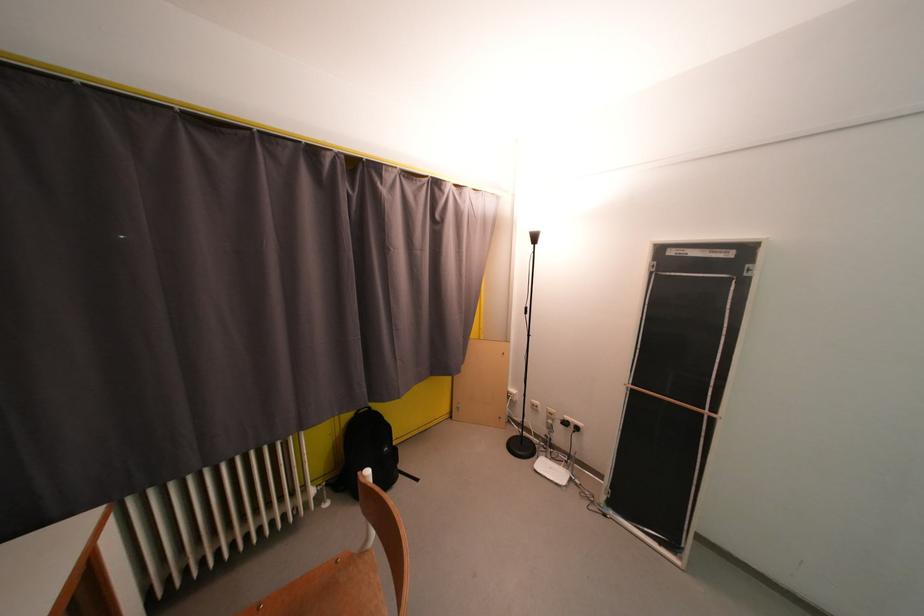
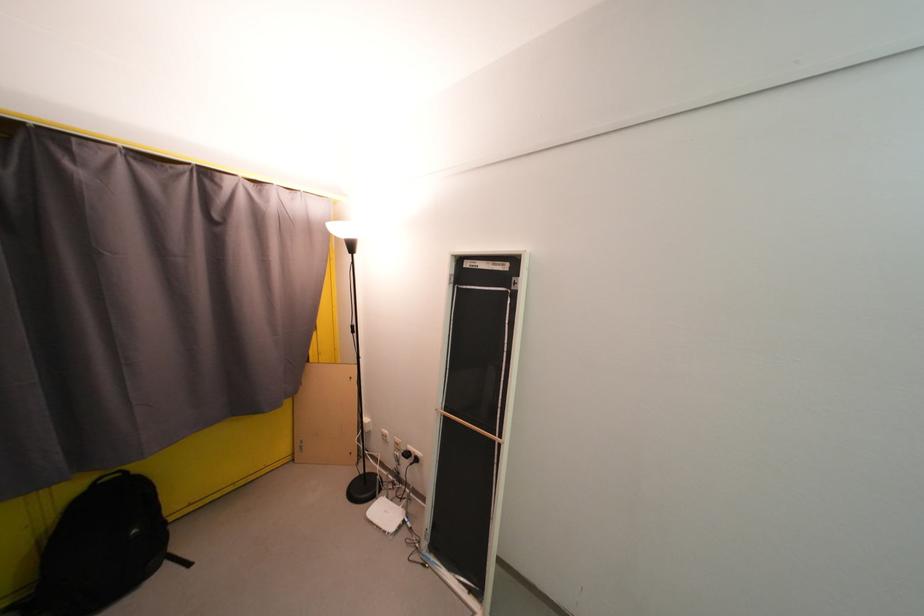
Question: The camera is either moving clockwise (left) or counter-clockwise (right) around the object. The first image is from the beginning of the video and the second image is from the end. Is the camera moving left or right when shooting the video?

Choices:
 (A) Left
 (B) Right

Answer: (A)